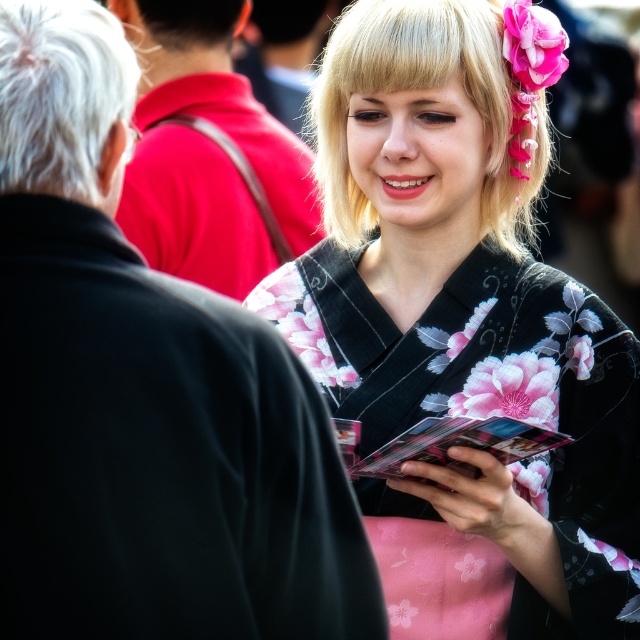
You are standing at the point marked by the coordinate point (387,140). A friend is located at your current position and wants to know how far they are from you. What should you tell them?

The point (387,140) and the viewer are 3.51 meters apart, so you can inform your friend that they are 3.51 meters away from you.

From the picture: You are a photographer adjusting your camera settings to capture the scene. The floral silk kimono at center and the white matte hair at left are in focus. If you want to ensure both remain in focus, what minimum distance should your camera focus on?

The minimum focusing distance should be at least 12.74 inches to ensure both the floral silk kimono at center and the white matte hair at left remain in focus since they are 12.74 inches apart.

You are an artist sketching the scene. You need to ensure the proportions are accurate. Which object, the black floral kimono at center or the white matte hair at left, should you draw taller in your sketch?

The black floral kimono at center should be drawn taller than the white matte hair at left because the description states it has a greater height compared to the white matte hair at left.